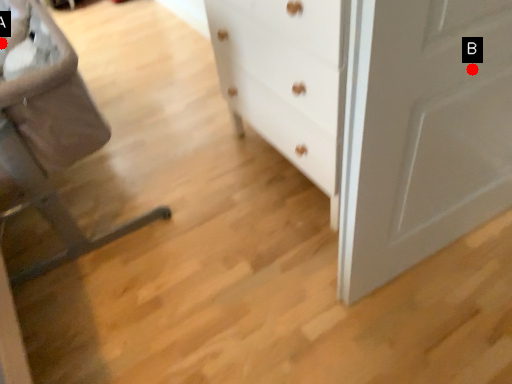
Question: Two points are circled on the image, labeled by A and B beside each circle. Which point is closer to the camera?

Choices:
 (A) A is closer
 (B) B is closer

Answer: (B)